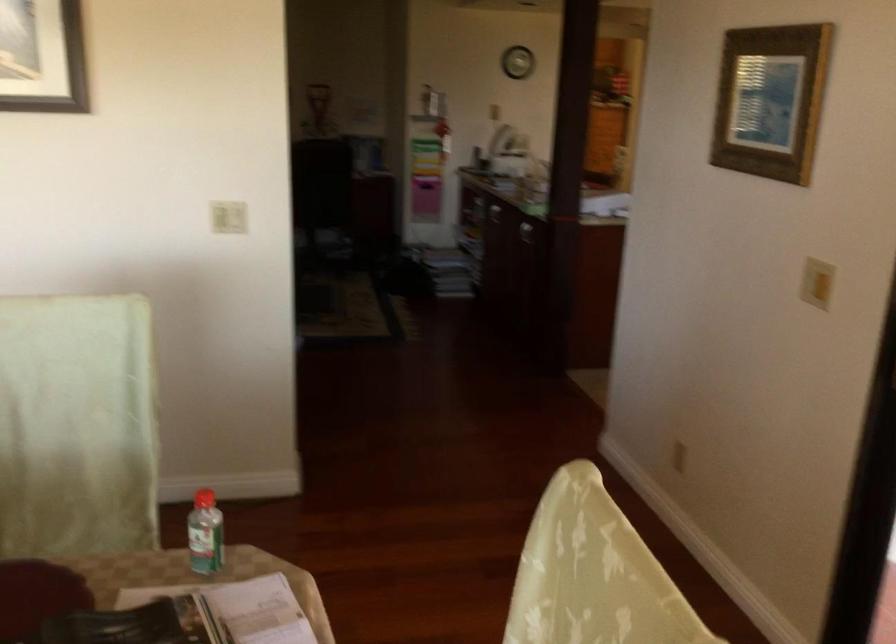
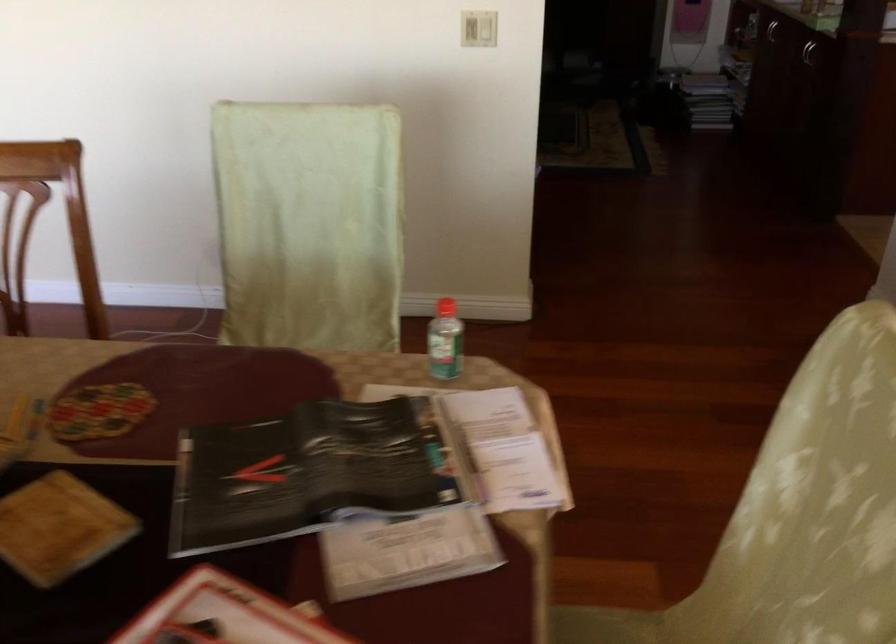
Where in the second image is the point corresponding to [204,540] from the first image?

(444, 341)